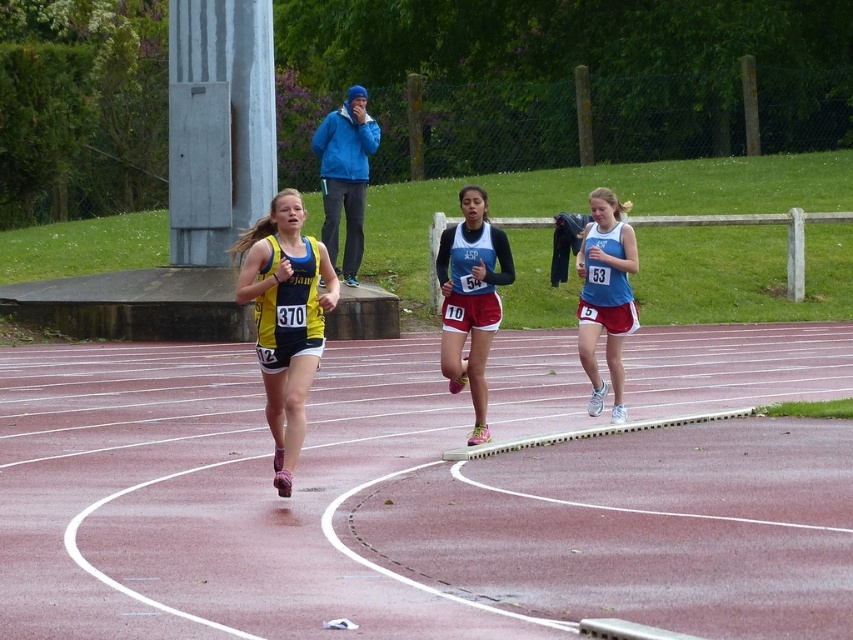
You are a photographer standing at the starting line of the track. You want to take a photo of the yellow fabric running suit at center without the pink rubber track at center blocking the view. Is it possible?

The pink rubber track at center is closer to the viewer than yellow fabric running suit at center, so the track would block the view of the running suit. Therefore, it is not possible to take the photo without the track blocking the view.

You are a photographer positioned at the finish line of the track. You need to capture a photo of the yellow fabric running suit at center and the matte black and red running uniform at center. Based on their widths, which athlete should you focus on first to ensure they are fully in frame?

The yellow fabric running suit at center has a greater width than the matte black and red running uniform at center. Therefore, you should focus on the yellow fabric running suit at center first to ensure it fits fully in the frame since it is wider.

You are a photographer positioned at the starting line of the race. You want to capture a photo that includes both the pink rubber track at center and the yellow fabric running suit at center. Based on their positions, which object should you adjust your camera to focus on first to ensure both are in the frame?

The yellow fabric running suit at center should be focused on first since the pink rubber track at center is to the right of it, meaning the track is positioned further right and the runner is closer to the center. By focusing on the runner first, you can then adjust the camera to include the track to the right.